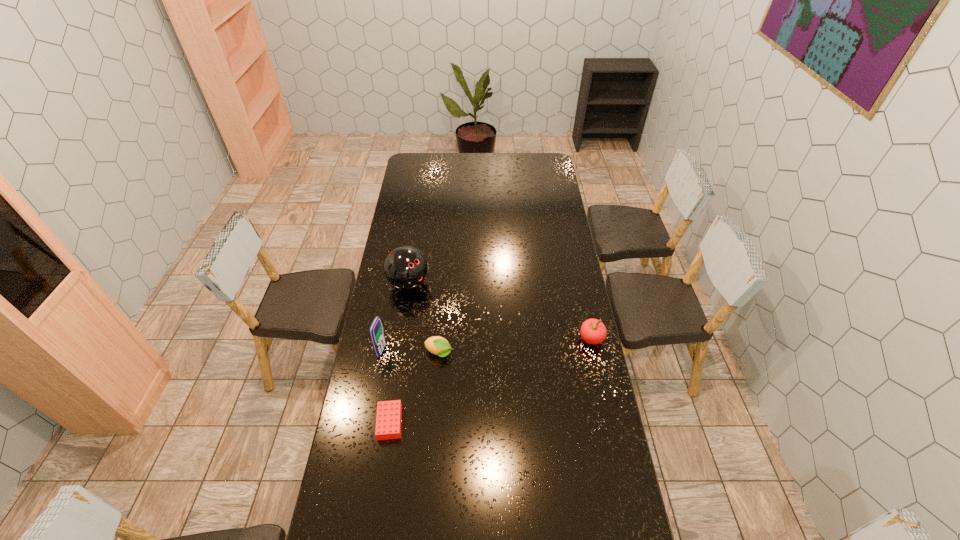
Where is `cellular telephone at the left edge`? The height and width of the screenshot is (540, 960). cellular telephone at the left edge is located at coordinates (376, 332).

In order to click on bowling ball that is at the left edge in this screenshot , I will do `click(406, 267)`.

In order to click on object present at the right edge in this screenshot , I will do `click(593, 331)`.

This screenshot has width=960, height=540. I want to click on vacant space at the far edge of the desktop, so click(494, 166).

I want to click on blank space at the left edge of the desktop, so click(426, 207).

Where is `vacant space at the right edge`? The height and width of the screenshot is (540, 960). vacant space at the right edge is located at coordinates (582, 390).

What are the coordinates of `vacant space at the far left corner of the desktop` in the screenshot? It's located at (418, 163).

You are a GUI agent. You are given a task and a screenshot of the screen. Output one action in this format:
    pyautogui.click(x=<x>, y=<y>)
    Task: Click on the blank space at the near right corner of the desktop
    The image size is (960, 540).
    Given the screenshot: What is the action you would take?
    pyautogui.click(x=583, y=526)

Image resolution: width=960 pixels, height=540 pixels. What are the coordinates of `free space that is in between the shortest object and the apple` in the screenshot? It's located at click(x=491, y=381).

In order to click on free space between the shortest object and the bowling ball in this screenshot , I will do `click(399, 353)`.